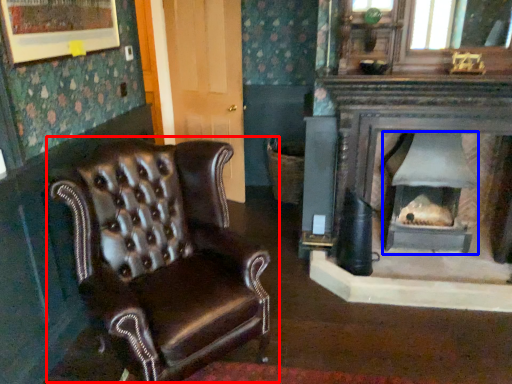
Question: Which object is closer to the camera taking this photo, chair (highlighted by a red box) or wood burning stove (highlighted by a blue box)?

Choices:
 (A) chair
 (B) wood burning stove

Answer: (A)